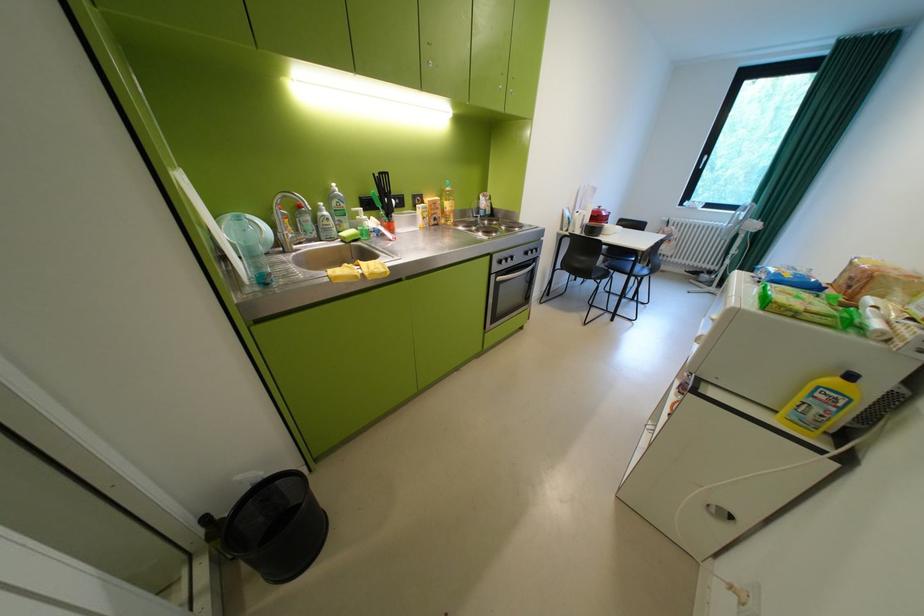
Where would you lift the red pot lid handle? Please return your answer as a coordinate pair (x, y).

(602, 207)